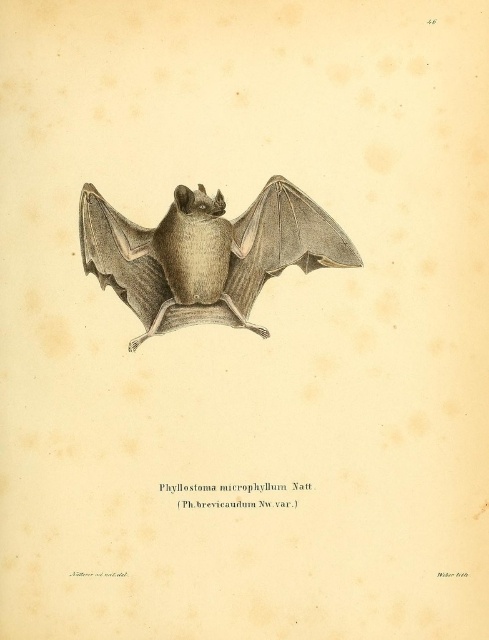
Question: Does gray textured wing at center appear under matte gray wing at center?

Choices:
 (A) no
 (B) yes

Answer: (B)

Question: Which point appears farthest from the camera in this image?

Choices:
 (A) (128, 266)
 (B) (227, 305)

Answer: (A)

Question: Which is nearer to the matte gray wing at center?

Choices:
 (A) gray textured bat at center
 (B) gray textured wing at center

Answer: (A)

Question: Estimate the real-world distances between objects in this image. Which object is closer to the gray textured bat at center?

Choices:
 (A) gray textured wing at center
 (B) matte gray wing at center

Answer: (A)

Question: Can you confirm if gray textured wing at center is positioned to the left of matte gray wing at center?

Choices:
 (A) no
 (B) yes

Answer: (A)

Question: Can you confirm if gray textured bat at center is positioned above gray textured wing at center?

Choices:
 (A) no
 (B) yes

Answer: (B)